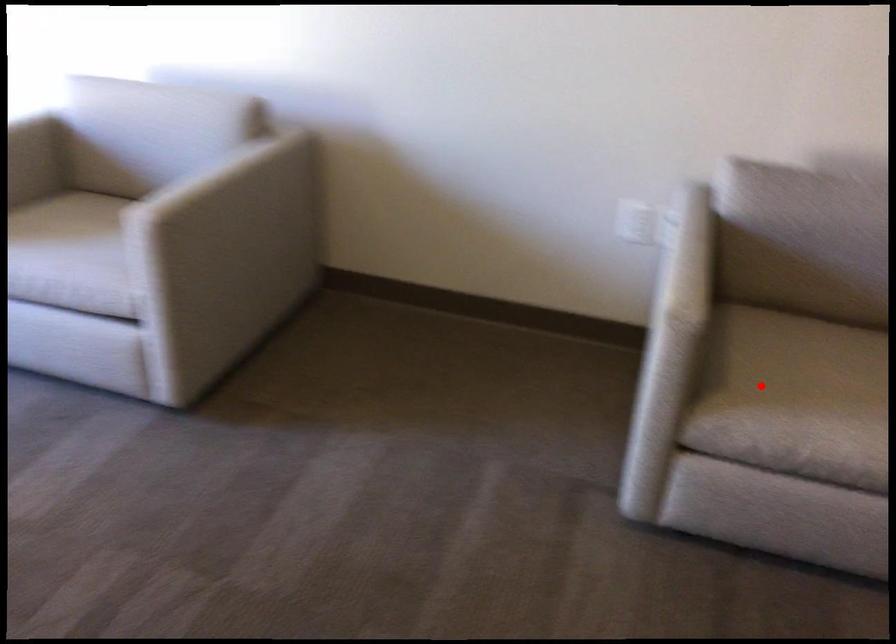
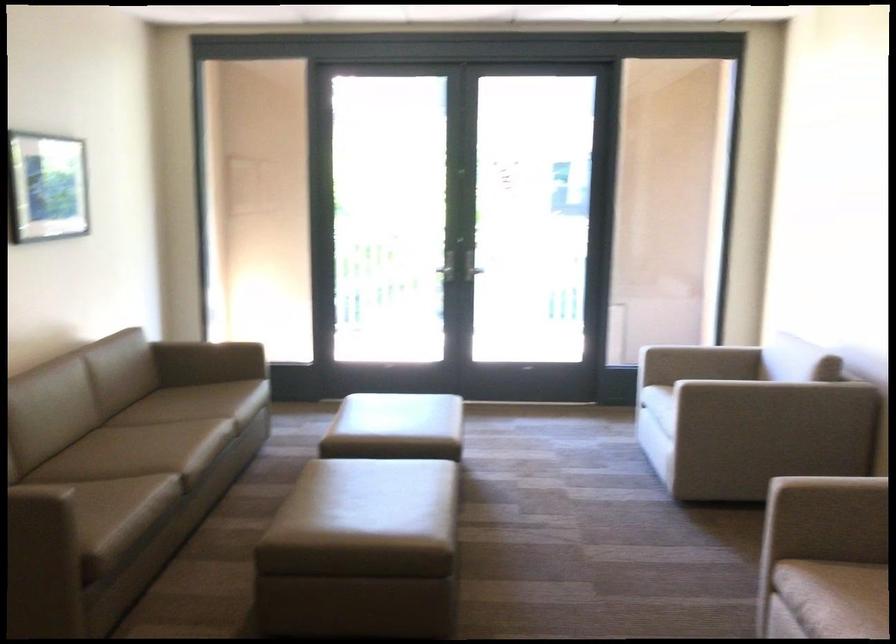
Question: I am providing you with two images of the same scene from different viewpoints. Given a red point in image1, look at the same physical point in image2. Is it:

Choices:
 (A) Closer to the viewpoint
 (B) Farther from the viewpoint

Answer: (B)